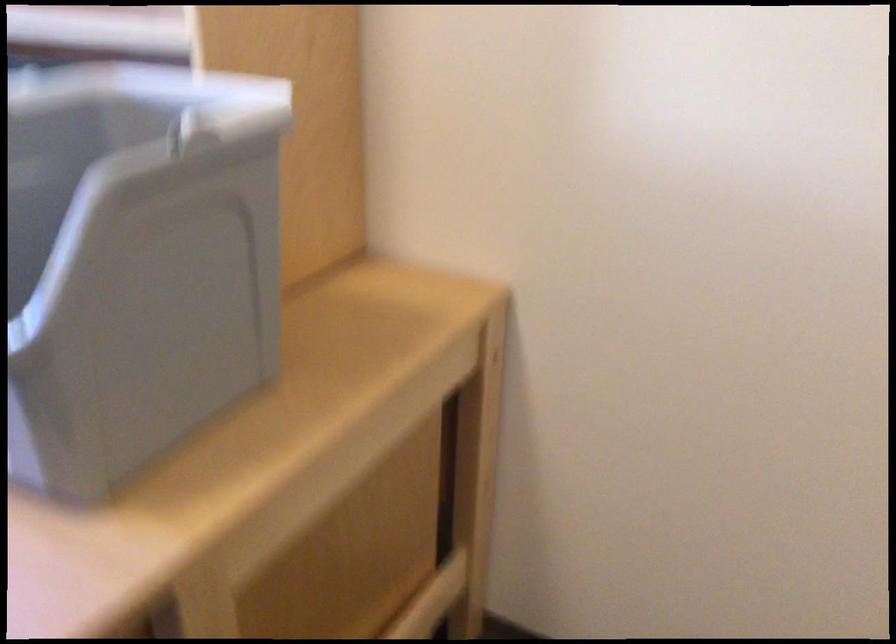
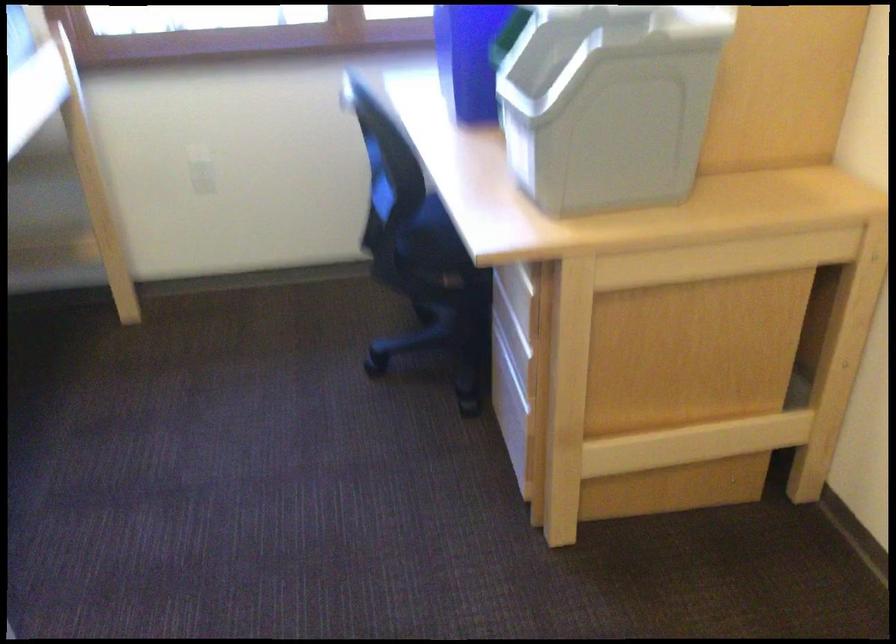
Question: Based on the continuous images, in which direction is the camera rotating? Reply with the corresponding letter.

Choices:
 (A) Left
 (B) Right
 (C) Up
 (D) Down

Answer: (A)